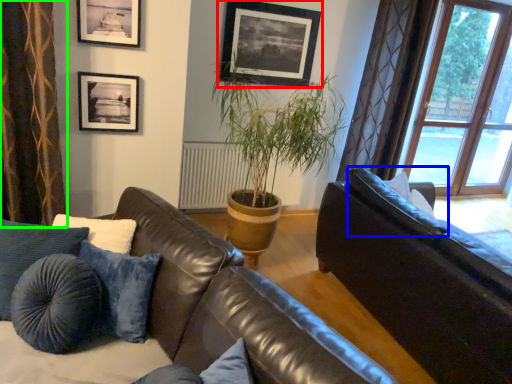
Question: Which is nearer to the picture frame (highlighted by a red box)? pillow (highlighted by a blue box) or curtain (highlighted by a green box).

Choices:
 (A) pillow
 (B) curtain

Answer: (A)